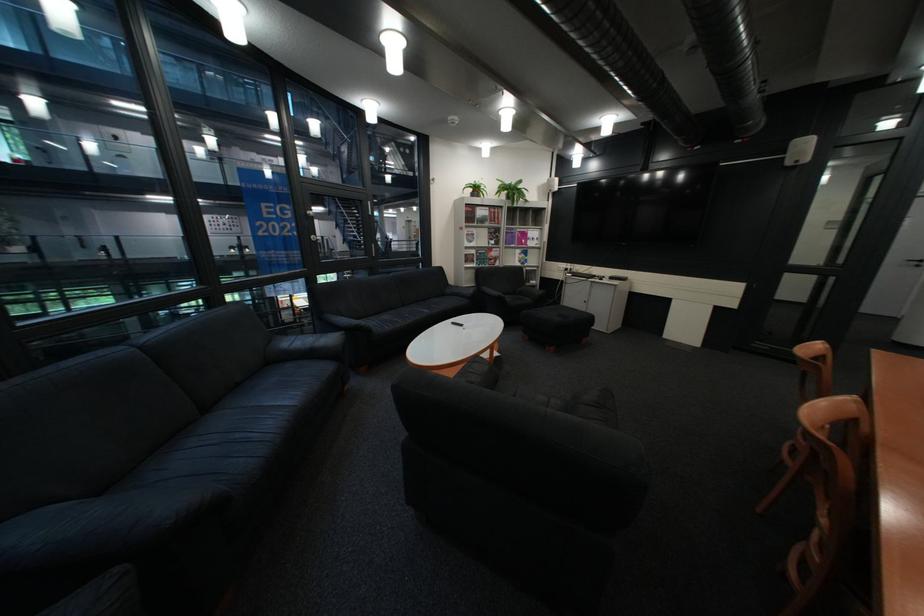
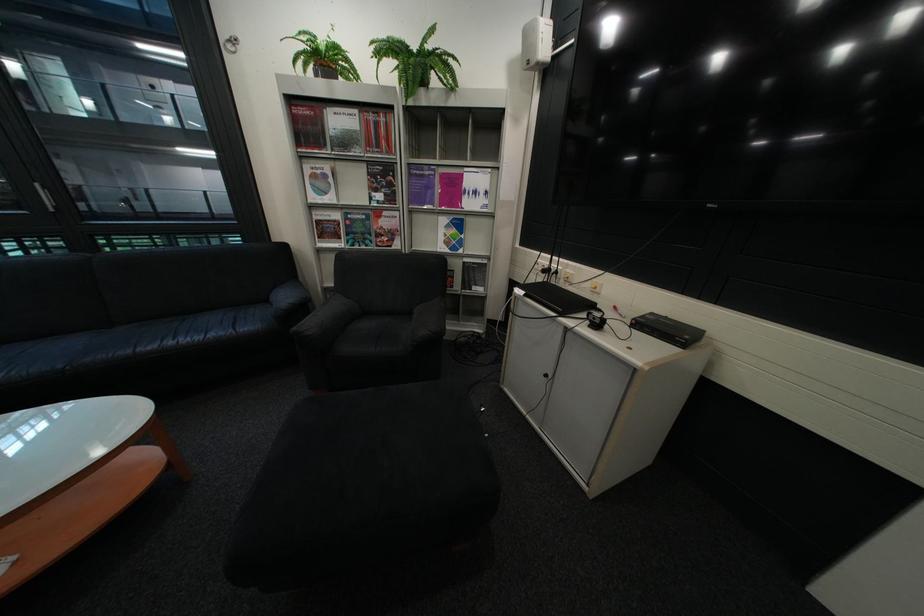
Where in the second image is the point corresponding to (586,275) from the first image?

(538, 293)